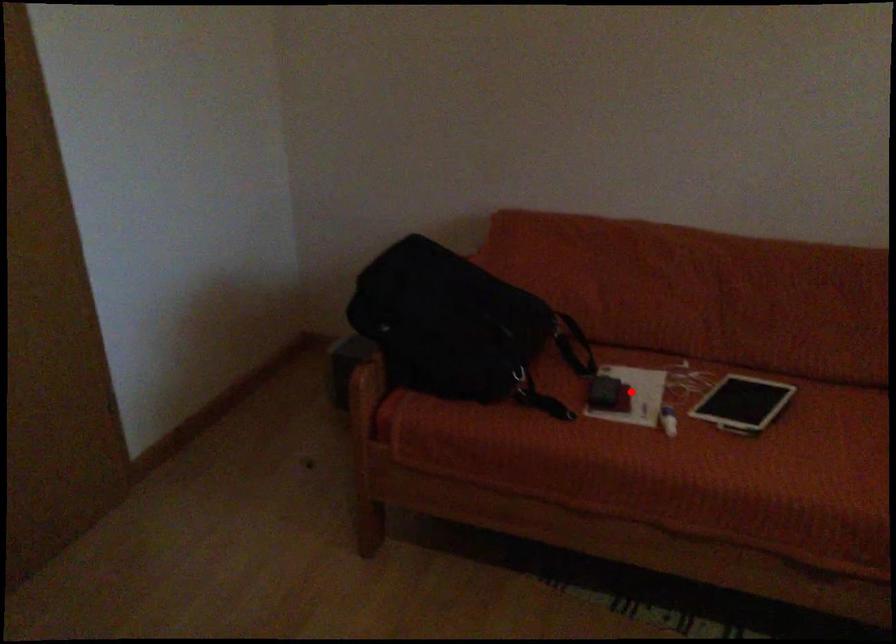
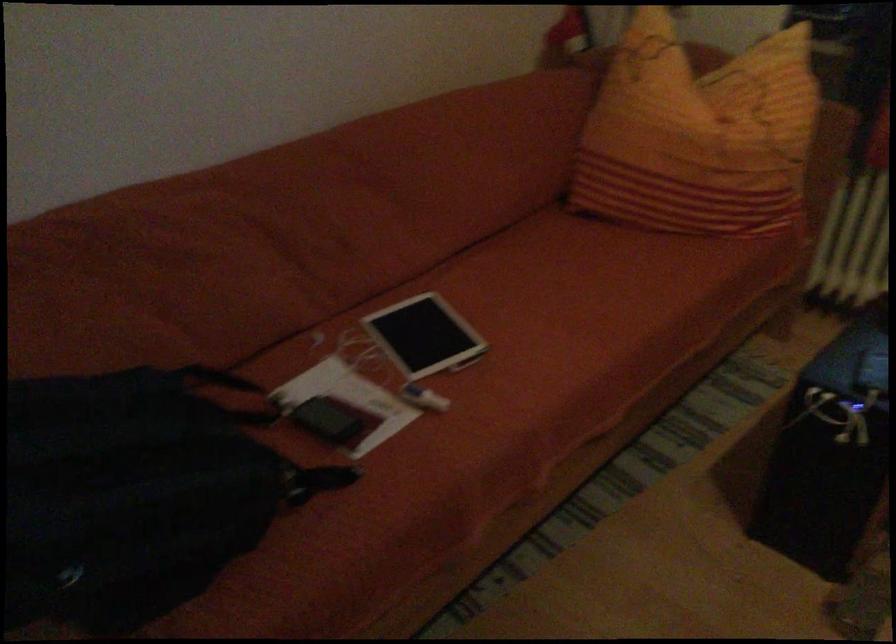
Question: A red point is marked in image1. In image2, is the corresponding 3D point closer to the camera or farther? Reply with the corresponding letter.

Choices:
 (A) The corresponding 3D point is closer.
 (B) The corresponding 3D point is farther.

Answer: (A)